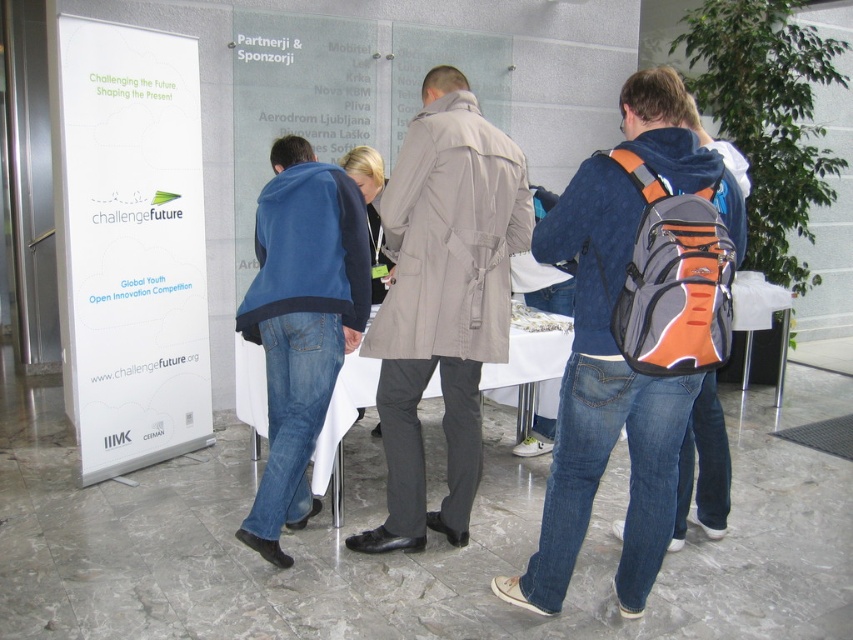
You are organizing an event and need to place a large item in the center of the room. The orange and gray backpack at center and the white paperboard at left are available. Which item should you choose to occupy the central space effectively?

The orange and gray backpack at center has a larger size compared to the white paperboard at left, so it is better suited to occupy the central space effectively.

You are standing in the room and looking at the banner. There are two points marked in the image, point 1 at coordinates point (154,65) and point 2 at coordinates point (567,321). Which point is closer to you?

Point (154,65) is further to the camera than point (567,321), so the point closer to you is point (567,321).

You are organizing a presentation and need to place a laptop on the white cloth at center. To ensure the laptop doesn not block the white paperboard at left, where should you position it?

Since the white paperboard at left is above the white cloth at center, placing the laptop on the lower part of the white cloth at center will keep it from blocking the white paperboard at left.